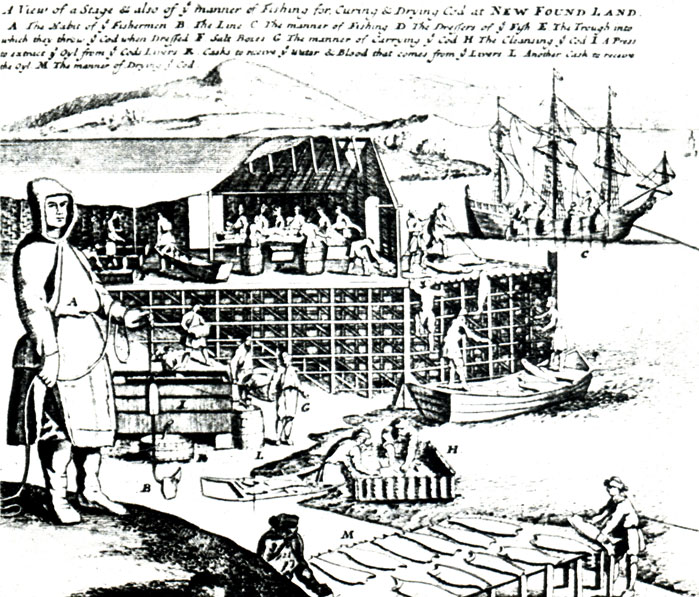
Image resolution: width=699 pixels, height=597 pixels. Identify the location of hood. (45, 181).